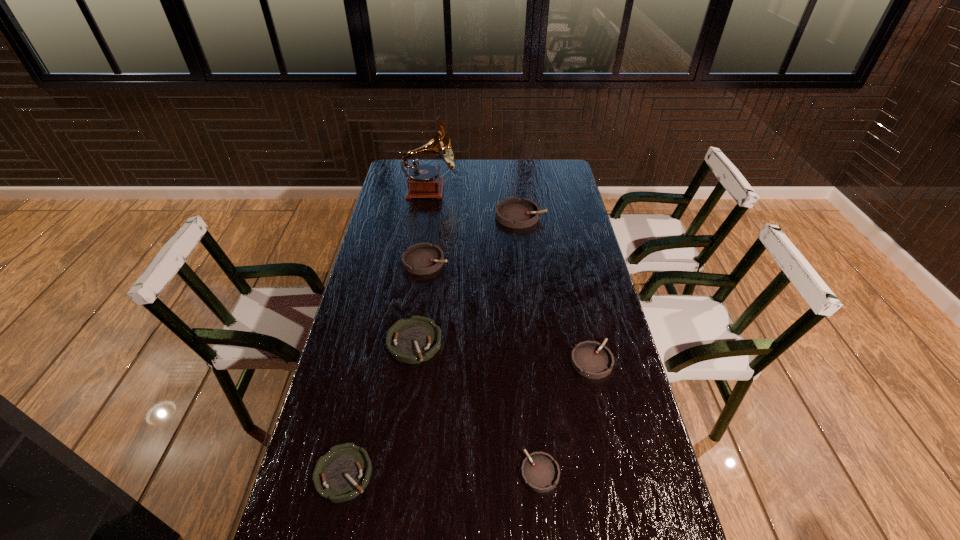
Where is `free space located 0.180m on the back of the second tallest object`? This screenshot has width=960, height=540. free space located 0.180m on the back of the second tallest object is located at coordinates (516, 181).

The height and width of the screenshot is (540, 960). Find the location of `vacant space positioned on the left of the fifth shortest object`. vacant space positioned on the left of the fifth shortest object is located at coordinates (368, 261).

Locate an element on the screen. Image resolution: width=960 pixels, height=540 pixels. free spot located 0.270m on the front of the third biggest gray ashtray is located at coordinates (617, 474).

Where is `vacant space located 0.350m on the back of the bigger green ashtray`? Image resolution: width=960 pixels, height=540 pixels. vacant space located 0.350m on the back of the bigger green ashtray is located at coordinates (427, 252).

The width and height of the screenshot is (960, 540). I want to click on vacant region located 0.130m on the right of the nearest gray ashtray, so click(612, 472).

At what (x,y) coordinates should I click in order to perform the action: click on vacant region located on the right of the smaller green ashtray. Please return your answer as a coordinate pair (x, y). This screenshot has width=960, height=540. Looking at the image, I should click on (533, 474).

The width and height of the screenshot is (960, 540). What are the coordinates of `object at the far edge` in the screenshot? It's located at (423, 181).

Find the location of `phonograph_record situated at the left edge`. phonograph_record situated at the left edge is located at coordinates (423, 181).

Where is `object present at the far left corner`? The height and width of the screenshot is (540, 960). object present at the far left corner is located at coordinates 423,181.

This screenshot has width=960, height=540. I want to click on blank area at the far edge, so click(511, 165).